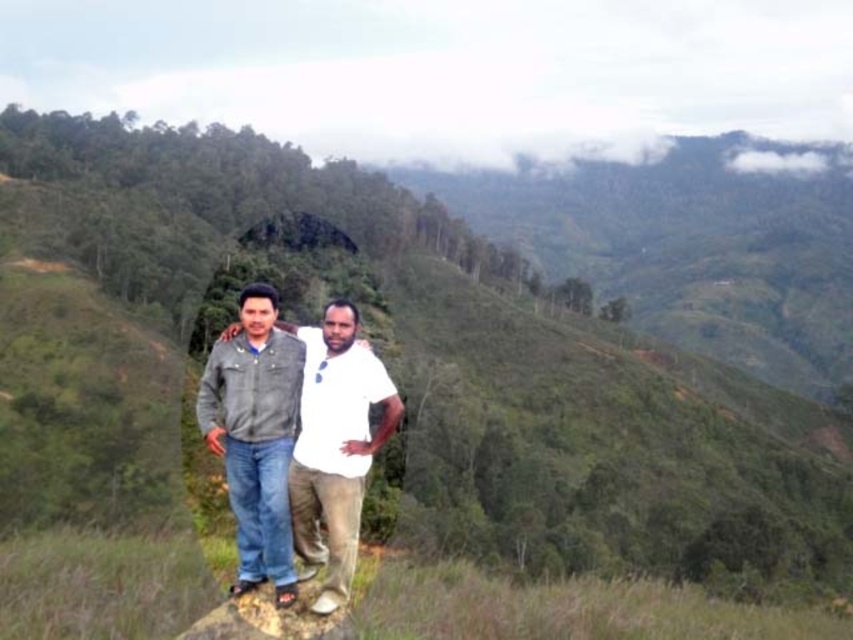
Who is higher up, denim jacket at center or smooth gray rock at lower center?

denim jacket at center is above.

Which is below, denim jacket at center or smooth gray rock at lower center?

smooth gray rock at lower center is below.

Is point (341, 381) positioned after point (244, 637)?

That is True.

The image size is (853, 640). I want to click on denim jacket at center, so click(x=325, y=429).